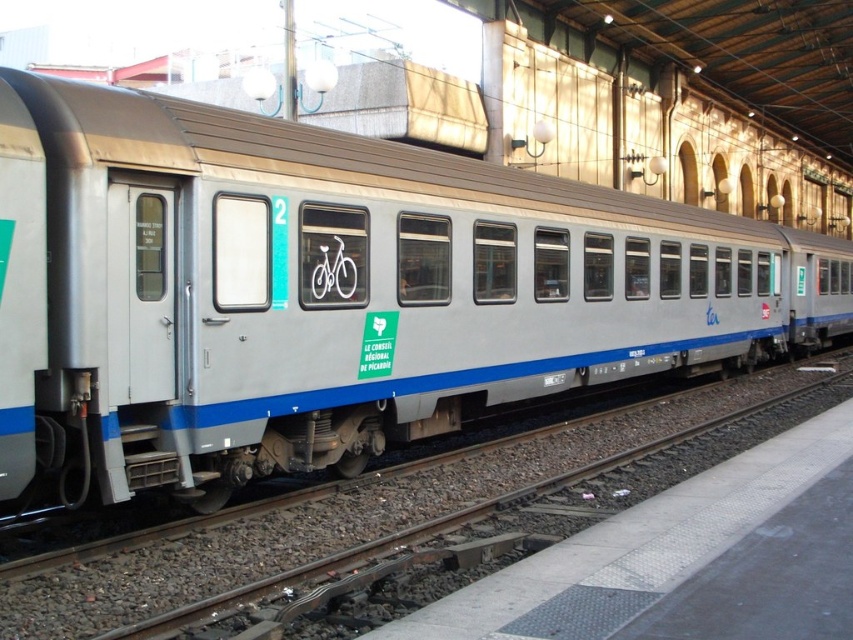
You are standing on the platform and looking at the metallic silver train at center and the metal track at lower left. Which object is taller?

The metallic silver train at center is taller than the metal track at lower left.

You are standing at the station platform and want to board the metallic silver train at center. Based on the coordinates provided, can you estimate how far you are from the train?

The metallic silver train at center is located at coordinates point (332, 291), so you are approximately at that position. However, without knowing your own coordinates, it is impossible to determine the exact distance between you and the train.

You are standing at the platform and want to board the metallic silver train at center. The platform doors are open, and you see the point at coordinates (332,291). Is this point the location of the metallic silver train at center?

Yes, the point at coordinates (332,291) represents the location of the metallic silver train at center.